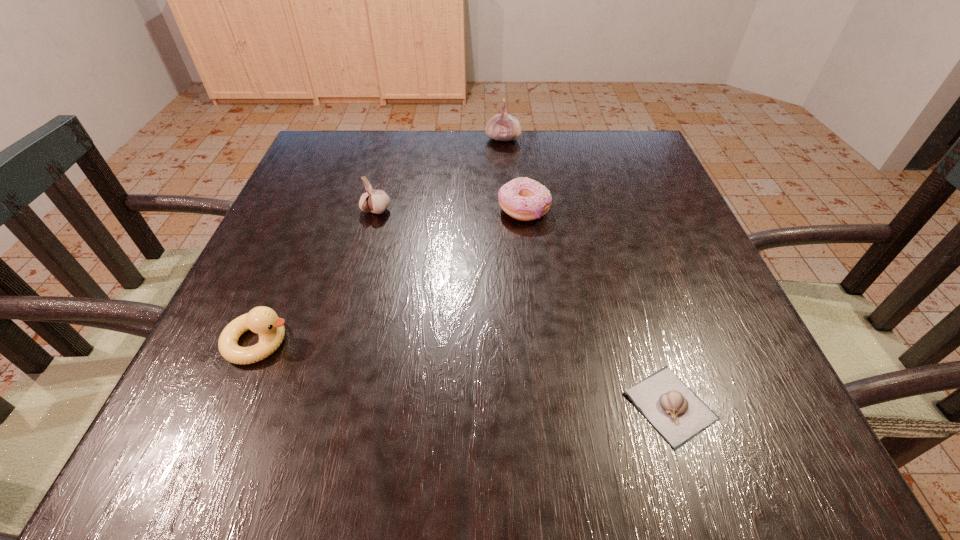
The height and width of the screenshot is (540, 960). What are the coordinates of `vacant region between the shortest object and the doughnut` in the screenshot? It's located at (597, 307).

Where is `free space between the second shortest garlic and the second garlic from left to right`? This screenshot has height=540, width=960. free space between the second shortest garlic and the second garlic from left to right is located at coordinates (440, 175).

Locate an element on the screen. free spot between the fourth tallest object and the shortest object is located at coordinates (597, 307).

Locate an element on the screen. the second closest object relative to the duckling is located at coordinates coord(525,199).

Identify the location of the closest object to the farthest object. [x=525, y=199].

I want to click on garlic that is the closest to the tallest object, so click(376, 201).

What are the coordinates of `the second closest garlic relative to the nearest garlic` in the screenshot? It's located at (503, 127).

Locate an element on the screen. vacant point that satisfies the following two spatial constraints: 1. on the back side of the doughnut; 2. on the left side of the second tallest garlic is located at coordinates (376, 210).

The height and width of the screenshot is (540, 960). I want to click on free region that satisfies the following two spatial constraints: 1. on the front side of the nearest garlic; 2. on the left side of the tallest object, so click(522, 406).

Where is `vacant space that satisfies the following two spatial constraints: 1. on the front side of the doughnut; 2. at the beak of the duckling`? The image size is (960, 540). vacant space that satisfies the following two spatial constraints: 1. on the front side of the doughnut; 2. at the beak of the duckling is located at coordinates 539,342.